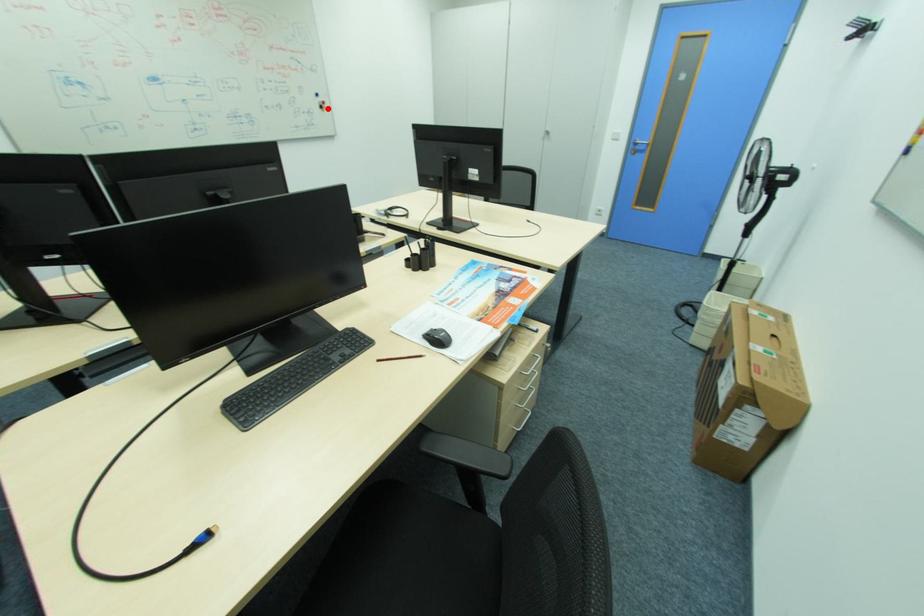
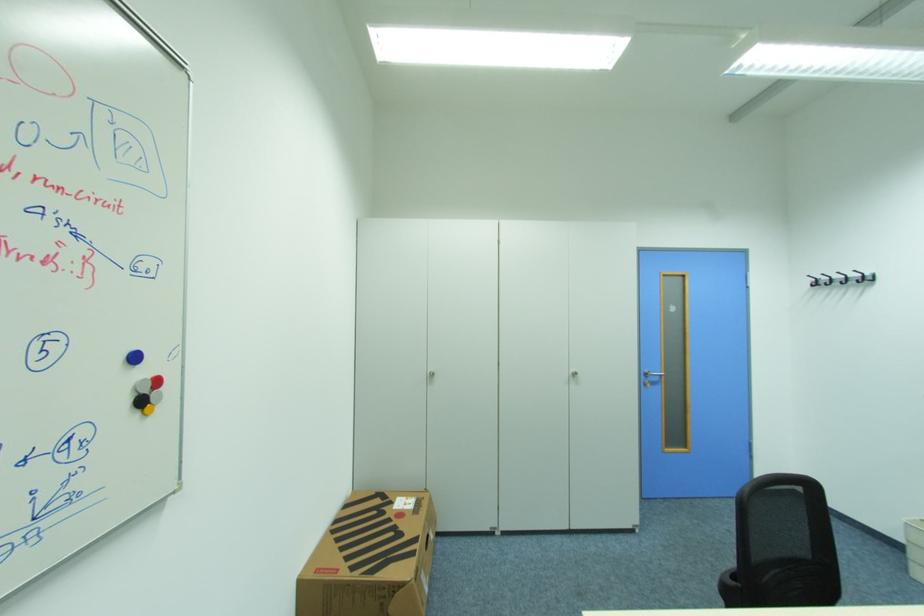
Question: I am providing you with two images of the same scene from different viewpoints. Given a red point in image1, look at the same physical point in image2. Is it:

Choices:
 (A) Closer to the viewpoint
 (B) Farther from the viewpoint

Answer: (B)